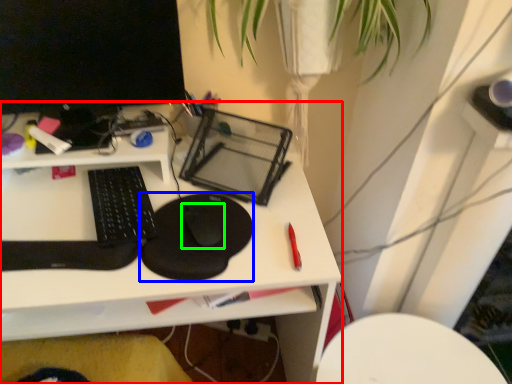
Question: Estimate the real-world distances between objects in this image. Which object is closer to desk (highlighted by a red box), mousepad (highlighted by a blue box) or mouse (highlighted by a green box)?

Choices:
 (A) mousepad
 (B) mouse

Answer: (A)